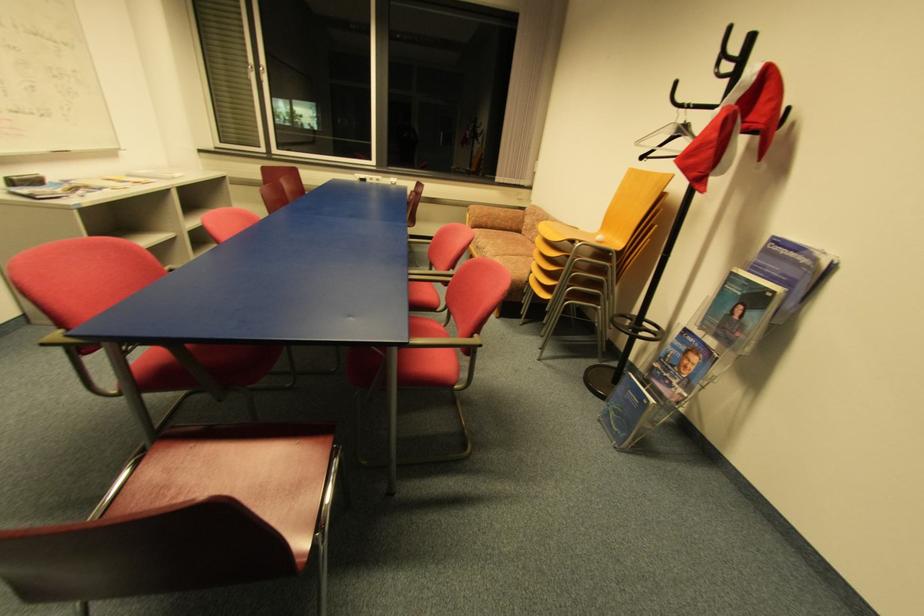
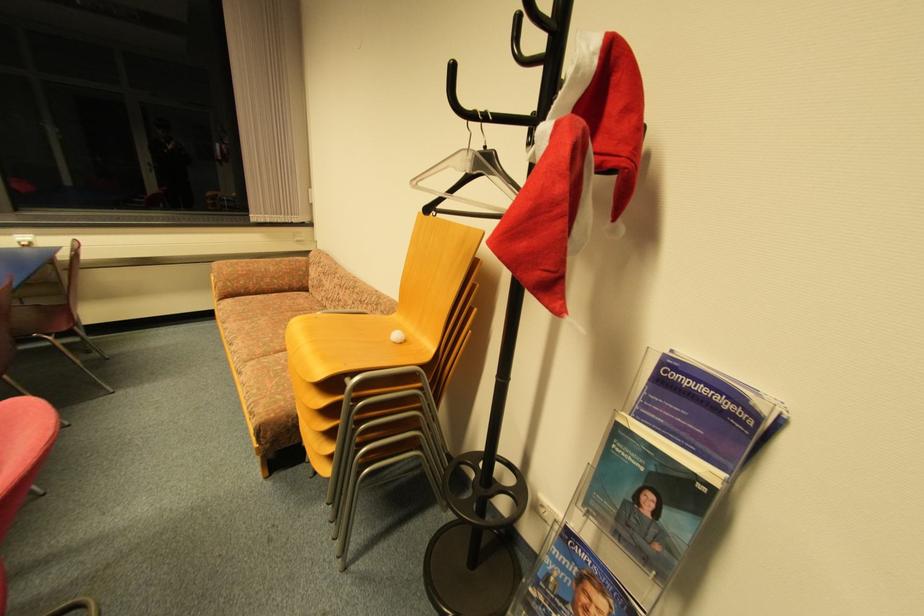
In the second image, find the point that corresponds to (x=642, y=144) in the first image.

(419, 184)